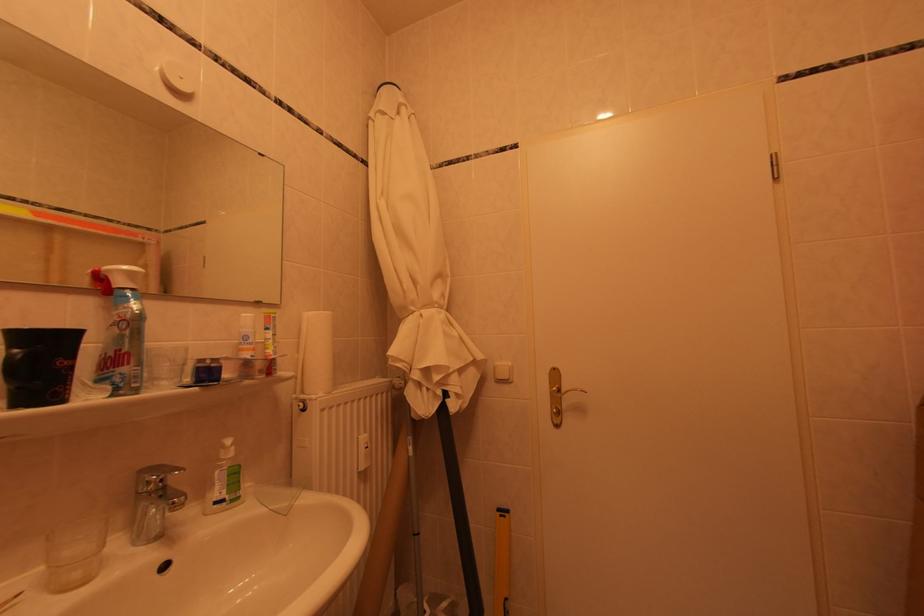
I want to click on black cup, so click(x=39, y=365).